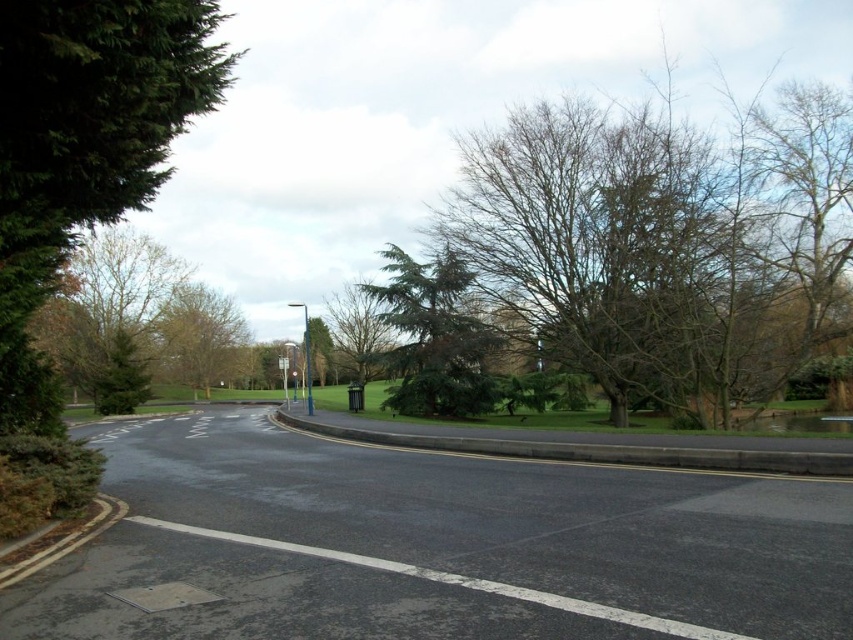
Question: Is green needle-like tree at center above blue metallic pole at center?

Choices:
 (A) yes
 (B) no

Answer: (A)

Question: Is green leafy tree at left bigger than green textured tree at center?

Choices:
 (A) yes
 (B) no

Answer: (B)

Question: Which point is closer to the camera?

Choices:
 (A) (206, 305)
 (B) (80, 3)
 (C) (280, 362)
 (D) (419, 406)

Answer: (B)

Question: Can you confirm if green leafy tree at center is bigger than green textured tree at center?

Choices:
 (A) yes
 (B) no

Answer: (B)

Question: Which of the following is the farthest from the observer?

Choices:
 (A) metallic rectangular sign at center
 (B) green textured tree at center
 (C) green needle-like tree at center

Answer: (A)

Question: Which object is the farthest from the green leafy tree at left?

Choices:
 (A) metallic rectangular sign at center
 (B) green leafy tree at center
 (C) blue metallic pole at center
 (D) green textured tree at center

Answer: (B)